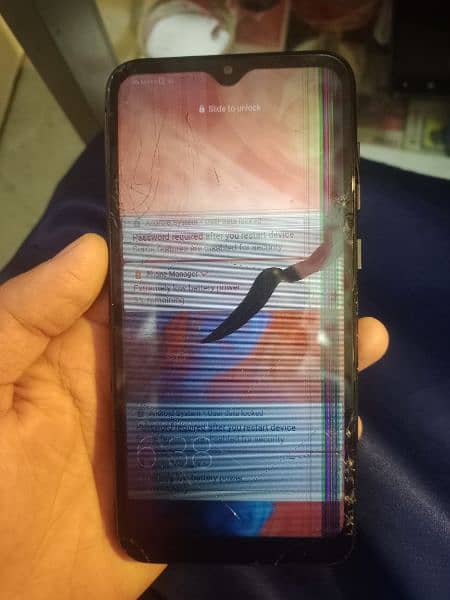
This screenshot has width=450, height=600. I want to click on beige floor, so click(x=31, y=149).